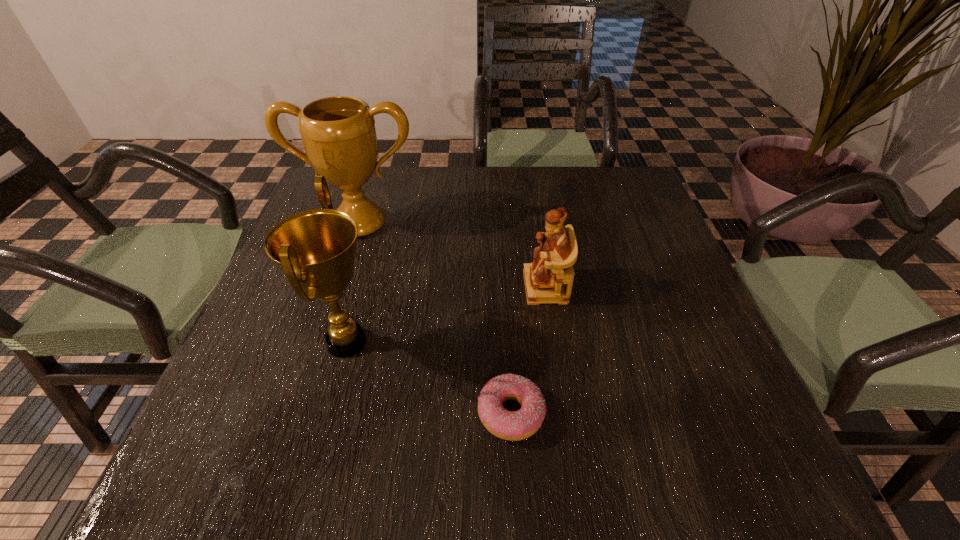
Identify the location of free space that satisfies the following two spatial constraints: 1. on the front view with handles of the nearer award; 2. on the back side of the shortest object. (327, 413).

Identify the location of vacant area in the image that satisfies the following two spatial constraints: 1. on the front of the farthest object with the decoration; 2. on the left side of the shortest object. (299, 413).

Locate an element on the screen. The image size is (960, 540). free space that satisfies the following two spatial constraints: 1. on the back side of the doughnut; 2. on the front view with handles of the nearer award is located at coordinates (507, 342).

The height and width of the screenshot is (540, 960). In order to click on blank area in the image that satisfies the following two spatial constraints: 1. on the front view with handles of the doughnut; 2. on the left side of the nearer award in this screenshot , I will do `click(327, 413)`.